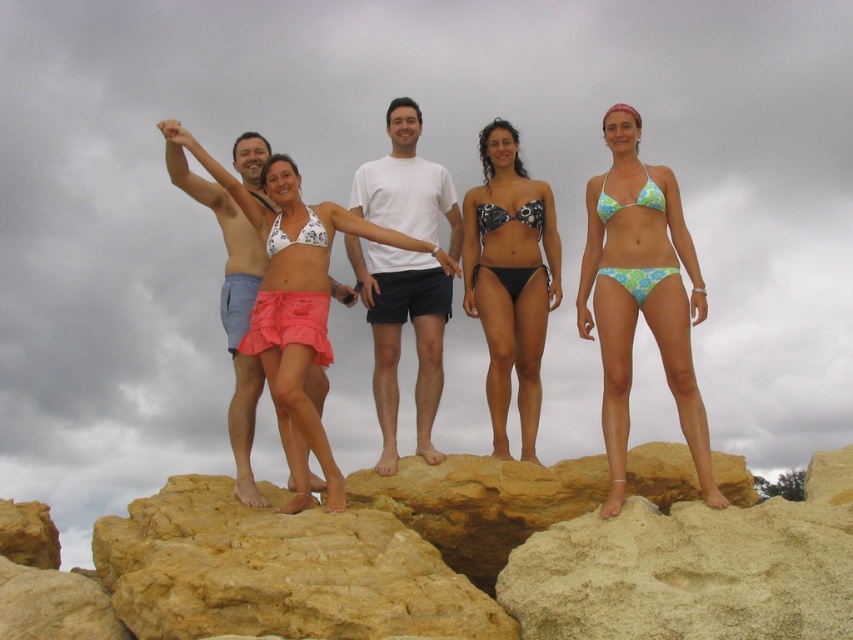
You are a photographer trying to capture a group photo of the green floral bikini at center and the white printed bikini at center. Which one would appear larger in the photo?

The green floral bikini at center would appear larger in the photo because it is closer to the viewer than the white printed bikini at center.